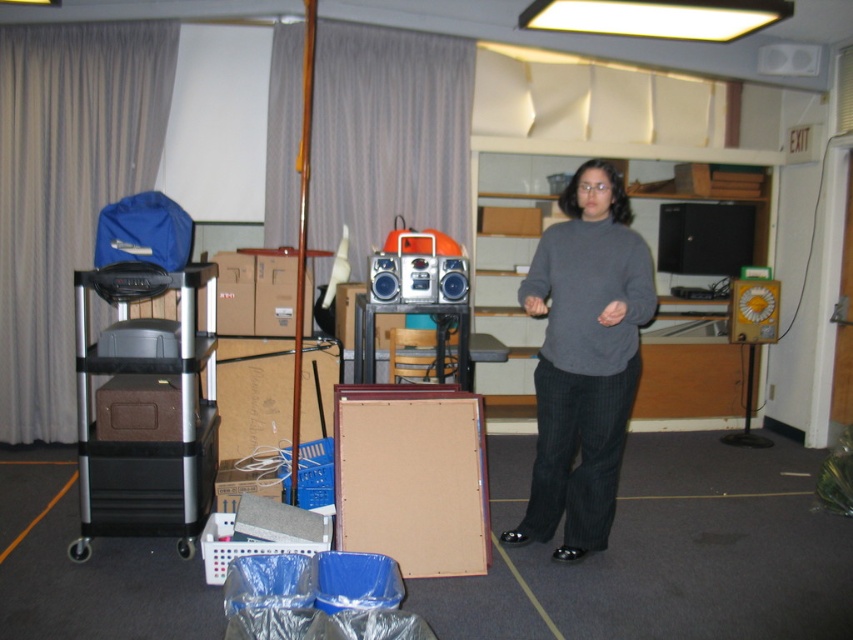
You are moving equipment and need to place the metallic silver cart at left closer to the shiny silver radio at center. How much distance do you need to move the cart to reach the radio?

The metallic silver cart at left is currently 37.20 inches away from the shiny silver radio at center, so you need to move it 37.20 inches to reach the radio.

You are standing in the storage room and need to move from the point at coordinates [97,518] to the point at coordinates [397,264]. Which direction should you move to get closer to your destination?

To move from point [97,518] to point [397,264], you should move towards the upper right direction since point [97,518] is closer to the viewer and your destination is further away in the upper right direction.